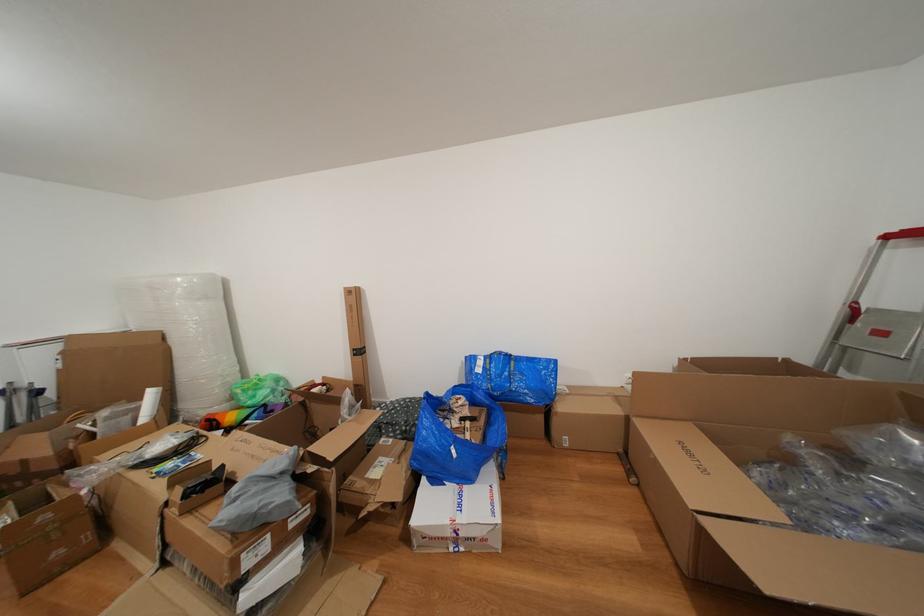
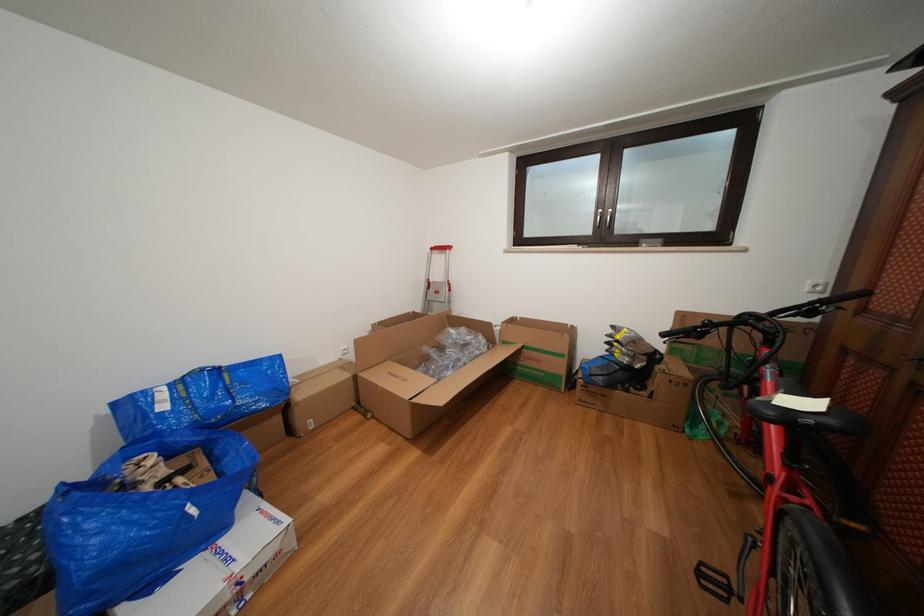
Where in the second image is the point corresponding to pixel 568 411 from the first image?

(309, 400)